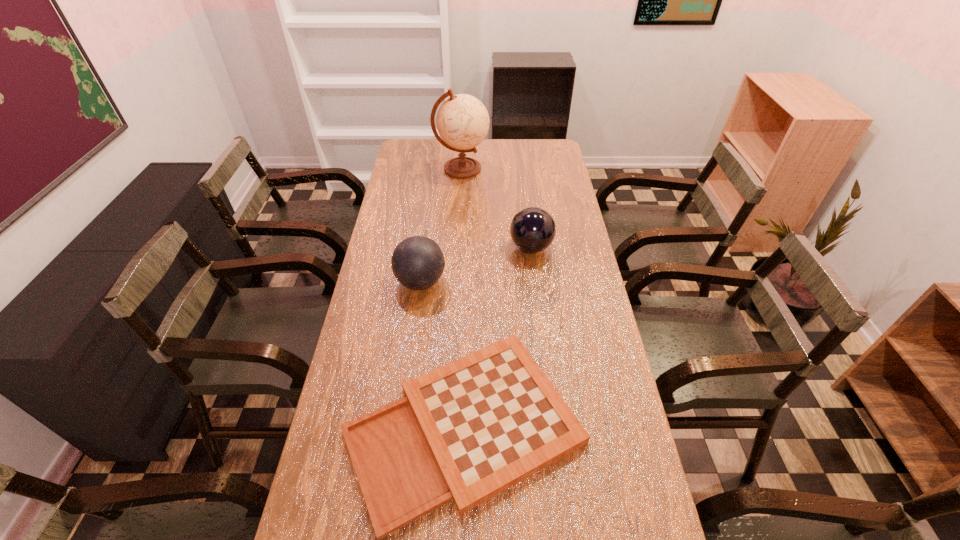
Find the location of a particular element. vacant space located 0.090m on the side of the farther bowling ball with the finger holes is located at coordinates (484, 247).

In order to click on object that is at the far edge in this screenshot , I will do `click(462, 121)`.

Find the location of a particular element. This screenshot has height=540, width=960. object present at the left edge is located at coordinates pyautogui.click(x=417, y=262).

Find the location of a particular element. The height and width of the screenshot is (540, 960). object positioned at the right edge is located at coordinates click(533, 229).

Locate an element on the screen. The width and height of the screenshot is (960, 540). vacant space at the far edge is located at coordinates (508, 160).

In the image, there is a desktop. Identify the location of free space at the left edge. This screenshot has height=540, width=960. (400, 288).

This screenshot has height=540, width=960. In order to click on vacant space at the right edge of the desktop in this screenshot , I will do `click(595, 352)`.

This screenshot has height=540, width=960. In the image, there is a desktop. What are the coordinates of `free space at the far left corner` in the screenshot? It's located at (425, 161).

I want to click on vacant space that's between the globe and the farther bowling ball, so click(496, 208).

This screenshot has width=960, height=540. What are the coordinates of `vacant area that lies between the farthest object and the farther bowling ball` in the screenshot? It's located at (496, 208).